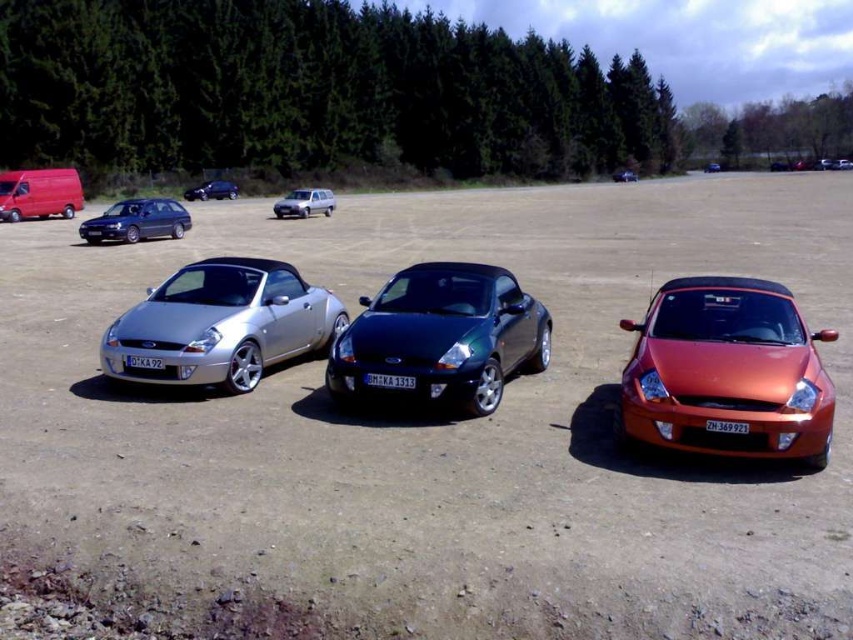
Question: Is silver metallic convertible at center below glossy metallic car at center?

Choices:
 (A) yes
 (B) no

Answer: (A)

Question: Which object is the closest to the metallic orange convertible at right?

Choices:
 (A) silver metallic hatchback at upper center
 (B) glossy dark green convertible at center

Answer: (B)

Question: Considering the real-world distances, which object is closest to the glossy dark green convertible at center?

Choices:
 (A) metallic orange convertible at right
 (B) metallic silver car at center
 (C) metallic blue convertible at center
 (D) silver metallic hatchback at upper center

Answer: (A)

Question: Is the position of silver metallic hatchback at upper center less distant than that of glossy metallic car at center?

Choices:
 (A) yes
 (B) no

Answer: (A)

Question: Considering the relative positions of metallic orange convertible at right and matte red van at upper left in the image provided, where is metallic orange convertible at right located with respect to matte red van at upper left?

Choices:
 (A) above
 (B) below

Answer: (B)

Question: Which object appears farthest from the camera in this image?

Choices:
 (A) glossy metallic car at center
 (B) metallic blue convertible at center
 (C) matte black hatchback at upper left
 (D) metallic silver car at center

Answer: (B)